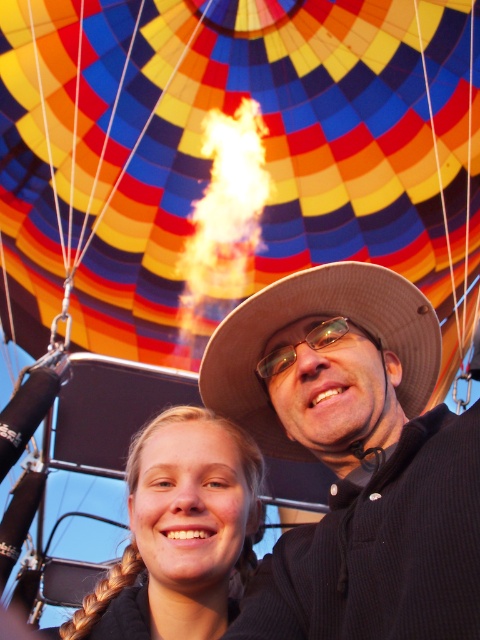
You are standing inside the hot air balloon and want to hand a souvenir to a friend who is standing near the brown woven hat at center. To reach them, you need to move from the multicolored fabric balloon at upper center. In which direction should you move?

The multicolored fabric balloon at upper center is to the left of the brown woven hat at center, so you should move to the right to reach your friend near the brown woven hat at center.

You are a photographer trying to capture the best angle of the hot air balloon scene. You notice two points marked in the image. Which point, point (321, 419) or point (272, 360), is positioned closer to you?

Point (321, 419) is closer to the viewer than point (272, 360).